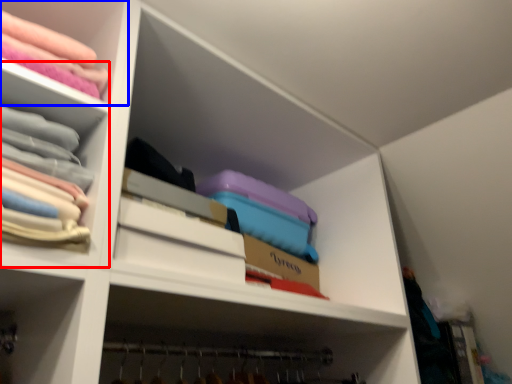
Question: Which object is further to the camera taking this photo, cabinet (highlighted by a red box) or shelf (highlighted by a blue box)?

Choices:
 (A) cabinet
 (B) shelf

Answer: (B)